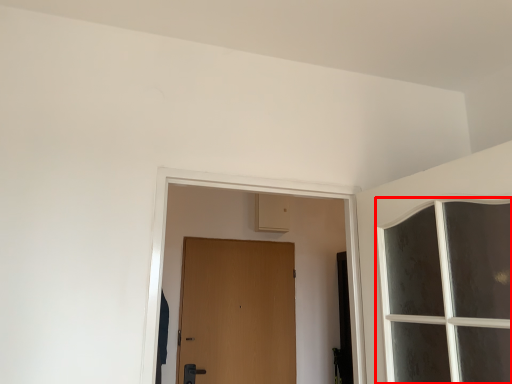
Question: From the image's perspective, considering the relative positions of window (annotated by the red box) and door in the image provided, where is window (annotated by the red box) located with respect to the staircase?

Choices:
 (A) below
 (B) above

Answer: (B)